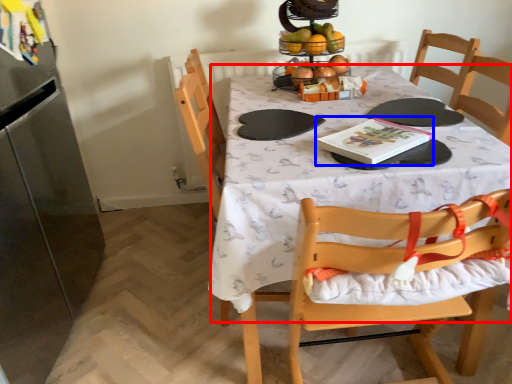
Question: Which point is further to the camera, tablecloth (highlighted by a red box) or book (highlighted by a blue box)?

Choices:
 (A) tablecloth
 (B) book

Answer: (B)